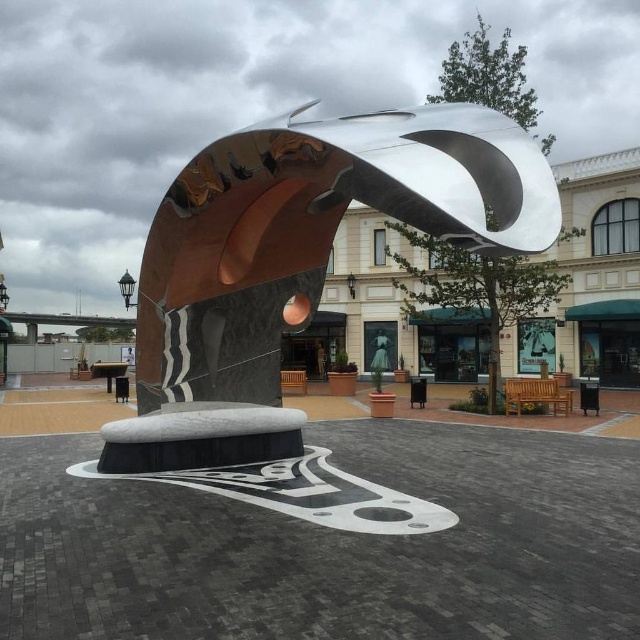
You are an art curator planning to move the polished metal sculpture at center and the polished silver sculpture at center to a smaller exhibition space. Based on their sizes, which sculpture would be easier to fit into a space with limited area?

The polished metal sculpture at center occupies less space than the polished silver sculpture at center, so it would be easier to fit into a space with limited area.

You are standing in the public square and see two points on the sculpture. The first point is at coordinate point (426, 168) and the second is at point (593, 358). Which point is closer to you?

Point (426, 168) is in front of point (593, 358), so it is closer to you.